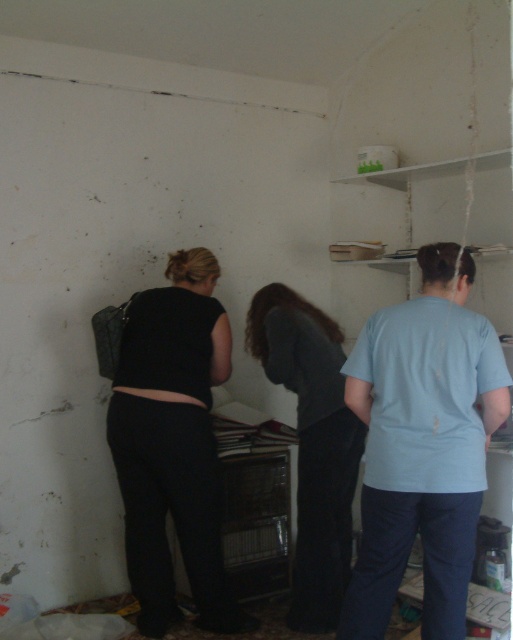
In the scene shown: You are in a room with two points marked on the wall. The first point is at coordinates point (x=424, y=269) and the second is at point (x=205, y=420). Which point is closer to you as you stand facing the wall?

Point (x=424, y=269) is closer to the camera than point (x=205, y=420), so the first point is closer to you.